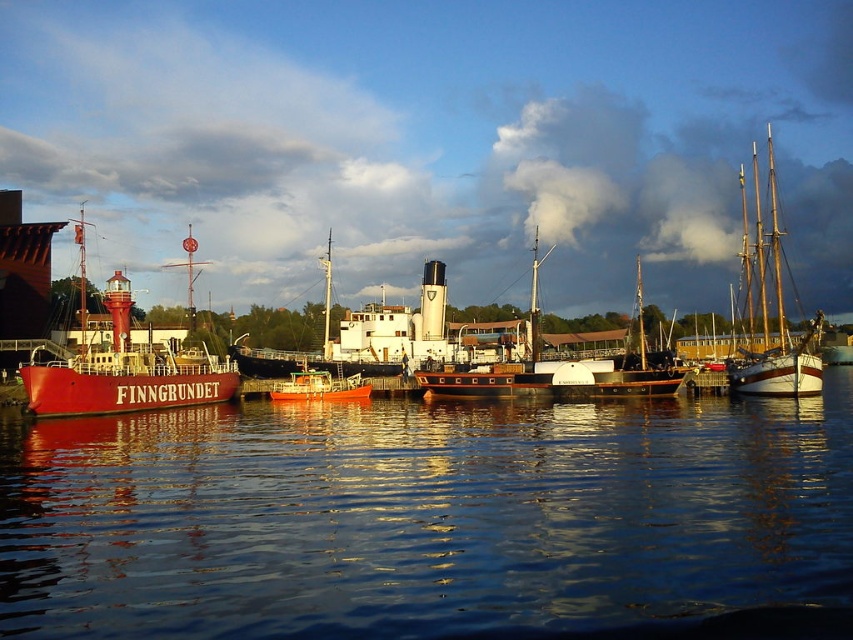
Question: Which of these objects is positioned closest to the wooden sailboat at right?

Choices:
 (A) wooden ship at center
 (B) metallic orange boat at center
 (C) transparent water at center

Answer: (A)

Question: Can you confirm if wooden ship at center is positioned below wooden sailboat at right?

Choices:
 (A) no
 (B) yes

Answer: (B)

Question: Can you confirm if wooden sailboat at right is wider than metallic orange boat at center?

Choices:
 (A) yes
 (B) no

Answer: (A)

Question: Which object is closer to the camera taking this photo?

Choices:
 (A) matte red ship at left
 (B) transparent water at center
 (C) metallic orange boat at center
 (D) wooden ship at center

Answer: (B)

Question: Among these objects, which one is farthest from the camera?

Choices:
 (A) wooden sailboat at right
 (B) metallic orange boat at center
 (C) transparent water at center

Answer: (B)

Question: Does wooden ship at center lie in front of wooden sailboat at right?

Choices:
 (A) yes
 (B) no

Answer: (B)